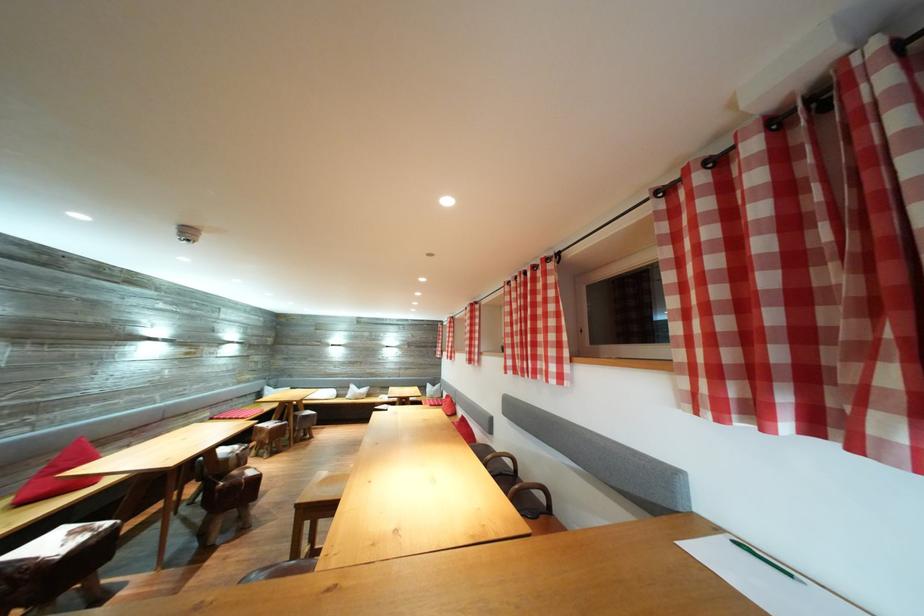
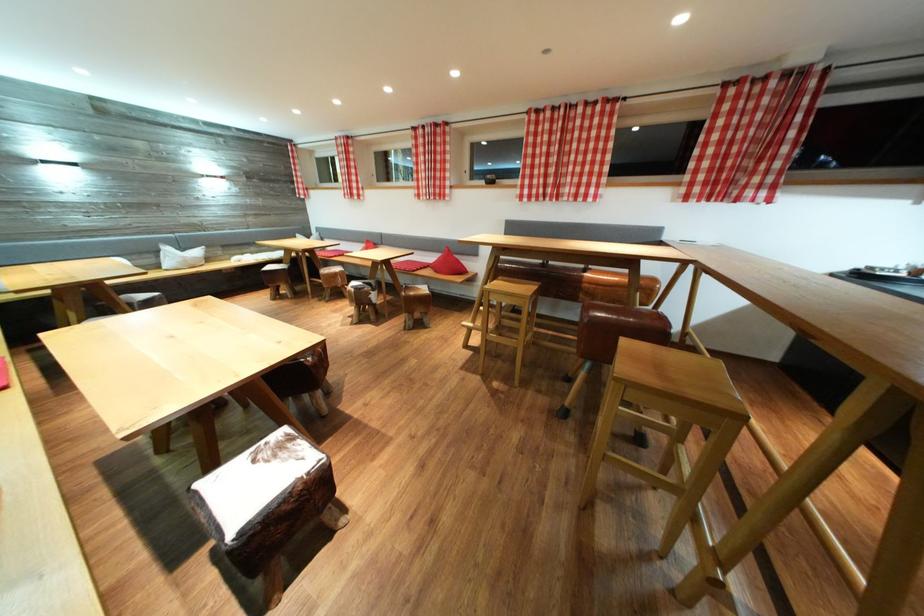
Find the pixel in the second image that matches (x=349, y=394) in the first image.

(151, 259)